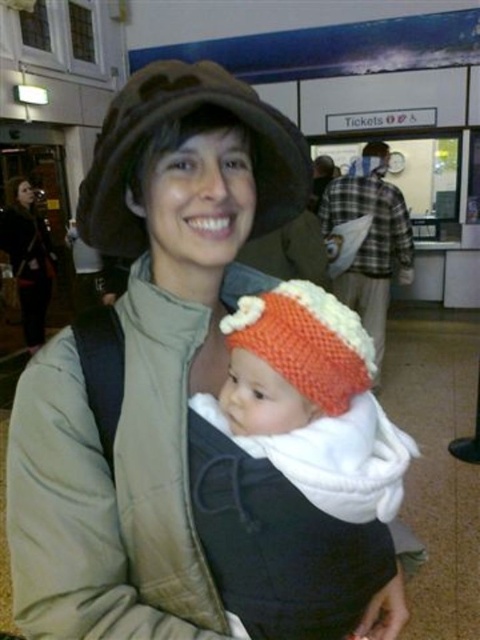
Can you confirm if brown fuzzy hat at upper center is positioned below matte black camera at upper left?

Correct, brown fuzzy hat at upper center is located below matte black camera at upper left.

Does point (260, 186) come behind point (19, 276)?

No, it is in front of (19, 276).

Find the location of `brown fuzzy hat at upper center`. brown fuzzy hat at upper center is located at coordinates click(x=164, y=138).

You are a GUI agent. You are given a task and a screenshot of the screen. Output one action in this format:
    pyautogui.click(x=<x>, y=<y>)
    Task: Click on the brown fuzzy hat at upper center
    Image resolution: width=480 pixels, height=640 pixels.
    Given the screenshot: What is the action you would take?
    pyautogui.click(x=164, y=138)

Does knitted orange hat at center have a greater height compared to matte black camera at upper left?

No, knitted orange hat at center is not taller than matte black camera at upper left.

Does knitted orange hat at center appear on the right side of matte black camera at upper left?

Yes, knitted orange hat at center is to the right of matte black camera at upper left.

Between point (348, 525) and point (39, 264), which one is positioned in front?

Point (348, 525)

At what (x,y) coordinates should I click in order to perform the action: click on knitted orange hat at center. Please return your answer as a coordinate pair (x, y). Image resolution: width=480 pixels, height=640 pixels. Looking at the image, I should click on (297, 467).

Who is more distant from viewer, (227, 449) or (263, 109)?

Point (227, 449)

Is knitted orange hat at center positioned in front of brown fuzzy hat at upper center?

Yes.

The width and height of the screenshot is (480, 640). Identify the location of knitted orange hat at center. (297, 467).